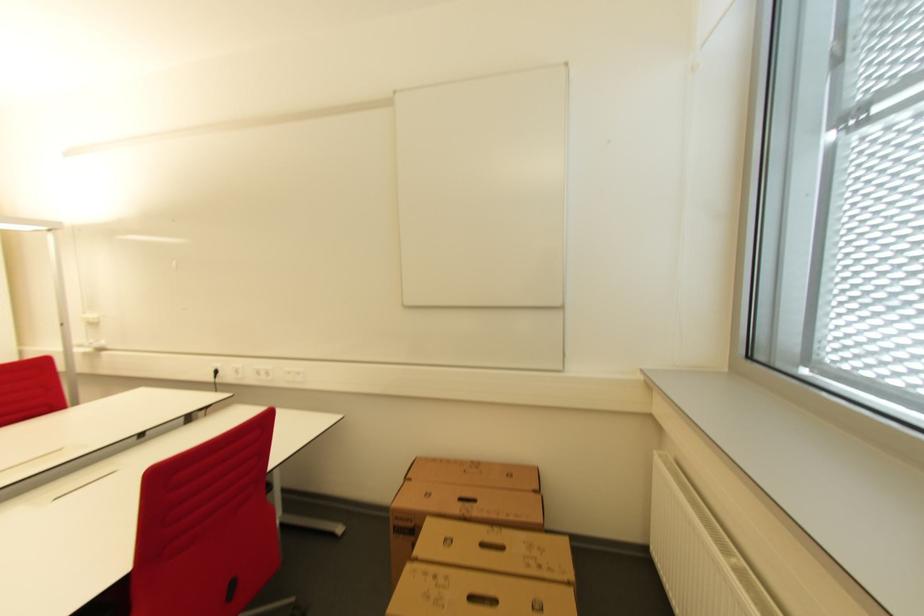
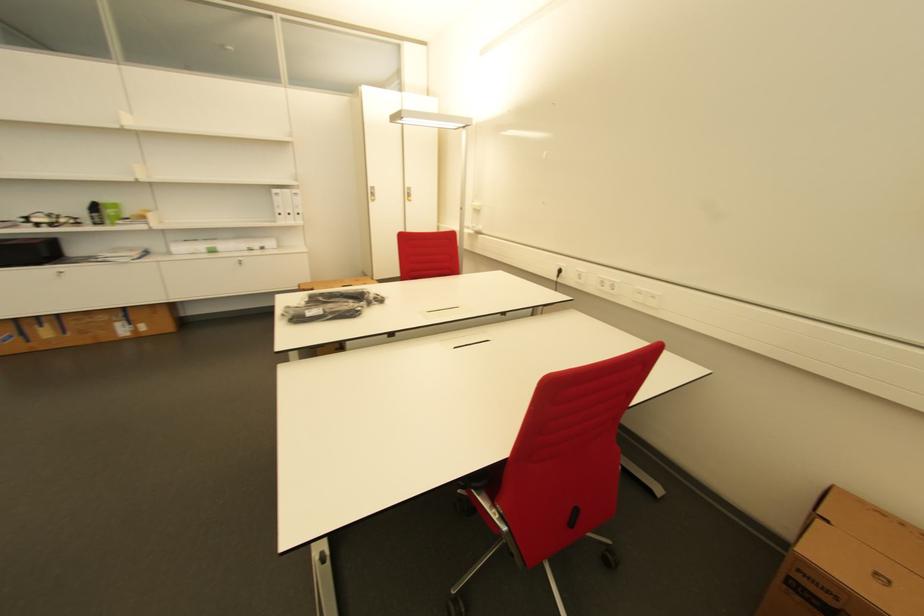
First-person continuous shooting, in which direction is the camera rotating?

The camera rotated toward left-down.